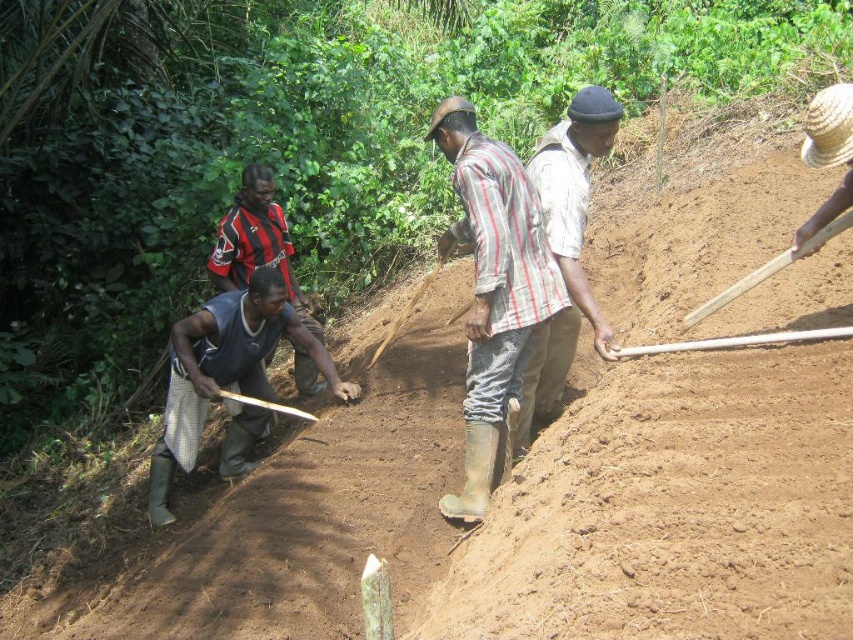
Question: From the image, what is the correct spatial relationship of light brown fabric shirt at center in relation to wooden shovel at center?

Choices:
 (A) left
 (B) right

Answer: (B)

Question: Which object is closer to the camera taking this photo?

Choices:
 (A) wooden shovel at right
 (B) light brown fabric shirt at center
 (C) gray fabric shirt at center
 (D) wooden shovel at center

Answer: (A)

Question: Can you confirm if striped cotton shirt at center is positioned above wooden shovel at center?

Choices:
 (A) yes
 (B) no

Answer: (B)

Question: Is striped cotton shirt at center thinner than wooden shovel at center?

Choices:
 (A) yes
 (B) no

Answer: (B)

Question: Considering the real-world distances, which object is closest to the wooden shovel at right?

Choices:
 (A) striped cotton shirt at center
 (B) gray fabric shirt at center
 (C) wooden shovel at center

Answer: (A)

Question: Which of the following is the closest to the observer?

Choices:
 (A) (519, 433)
 (B) (421, 284)
 (C) (502, 396)
 (D) (810, 237)

Answer: (D)